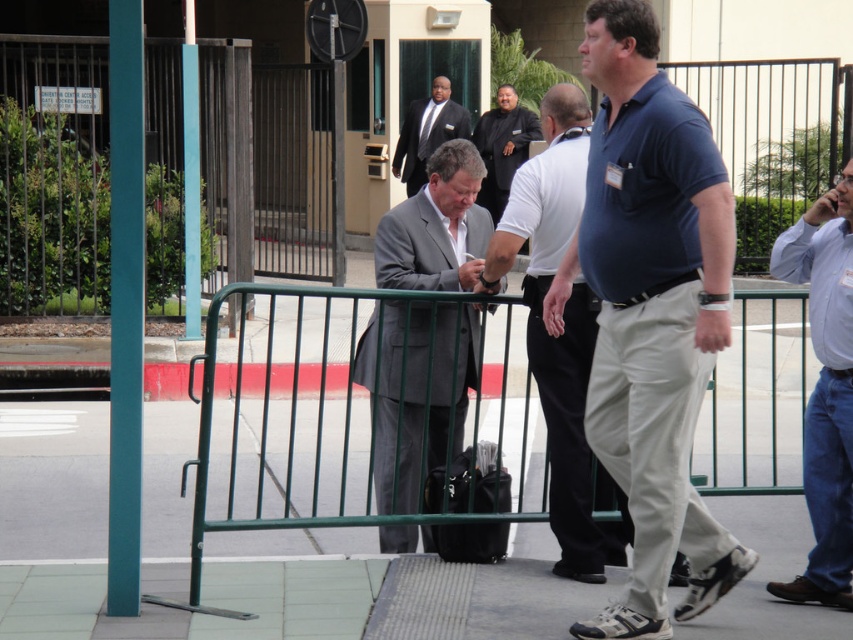
Does dark blue suit at center have a lesser height compared to matte black suit at center?

Incorrect, dark blue suit at center's height does not fall short of matte black suit at center's.

This screenshot has width=853, height=640. Describe the element at coordinates (502, 147) in the screenshot. I see `dark blue suit at center` at that location.

The image size is (853, 640). I want to click on dark blue suit at center, so click(502, 147).

How much distance is there between blue cotton polo shirt at center and light blue shirt at right?

blue cotton polo shirt at center is 98.19 centimeters from light blue shirt at right.

Is point (634, 131) positioned before point (851, 451)?

Yes.

You are a GUI agent. You are given a task and a screenshot of the screen. Output one action in this format:
    pyautogui.click(x=<x>, y=<y>)
    Task: Click on the blue cotton polo shirt at center
    
    Given the screenshot: What is the action you would take?
    pyautogui.click(x=651, y=314)

Does gray suit at center appear on the left side of light blue shirt at right?

Correct, you'll find gray suit at center to the left of light blue shirt at right.

Between point (399, 282) and point (842, 451), which one is positioned in front?

Point (842, 451) is in front.

Locate an element on the screen. The image size is (853, 640). gray suit at center is located at coordinates [x=416, y=392].